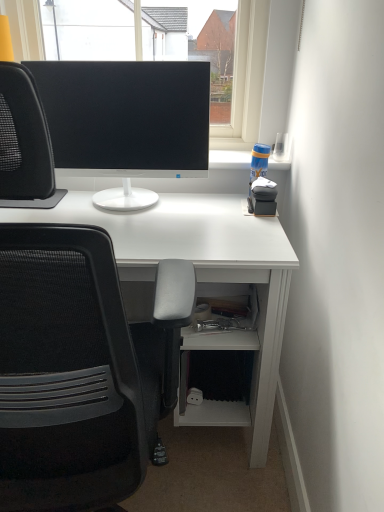
Question: Is black matte monitor at upper center far away from black mesh chair at left?

Choices:
 (A) no
 (B) yes

Answer: (B)

Question: Considering the relative positions of black matte monitor at upper center and black mesh chair at left in the image provided, is black matte monitor at upper center to the left of black mesh chair at left from the viewer's perspective?

Choices:
 (A) no
 (B) yes

Answer: (A)

Question: From a real-world perspective, is black matte monitor at upper center below black mesh chair at left?

Choices:
 (A) yes
 (B) no

Answer: (B)

Question: Is black matte monitor at upper center aimed at black mesh chair at left?

Choices:
 (A) no
 (B) yes

Answer: (B)

Question: Considering the relative sizes of black matte monitor at upper center and black mesh chair at left in the image provided, is black matte monitor at upper center bigger than black mesh chair at left?

Choices:
 (A) no
 (B) yes

Answer: (A)

Question: Is black mesh chair at left situated inside matte black monitor at center or outside?

Choices:
 (A) outside
 (B) inside

Answer: (A)

Question: Considering their positions, is black mesh chair at left located in front of or behind matte black monitor at center?

Choices:
 (A) front
 (B) behind

Answer: (A)

Question: Is point (66, 442) closer or farther from the camera than point (158, 90)?

Choices:
 (A) farther
 (B) closer

Answer: (B)

Question: From the image's perspective, is black mesh chair at left located above or below matte black monitor at center?

Choices:
 (A) below
 (B) above

Answer: (A)

Question: Is matte black monitor at center bigger or smaller than black matte monitor at upper center?

Choices:
 (A) big
 (B) small

Answer: (B)

Question: Choose the correct answer: Is matte black monitor at center inside black matte monitor at upper center or outside it?

Choices:
 (A) inside
 (B) outside

Answer: (B)

Question: In the image, is matte black monitor at center positioned in front of or behind black matte monitor at upper center?

Choices:
 (A) behind
 (B) front

Answer: (B)

Question: Would you say matte black monitor at center is to the left or to the right of black matte monitor at upper center in the picture?

Choices:
 (A) right
 (B) left

Answer: (B)

Question: In terms of size, does matte black monitor at center appear bigger or smaller than black mesh chair at left?

Choices:
 (A) small
 (B) big

Answer: (A)

Question: Relative to black mesh chair at left, is matte black monitor at center in front or behind?

Choices:
 (A) front
 (B) behind

Answer: (B)